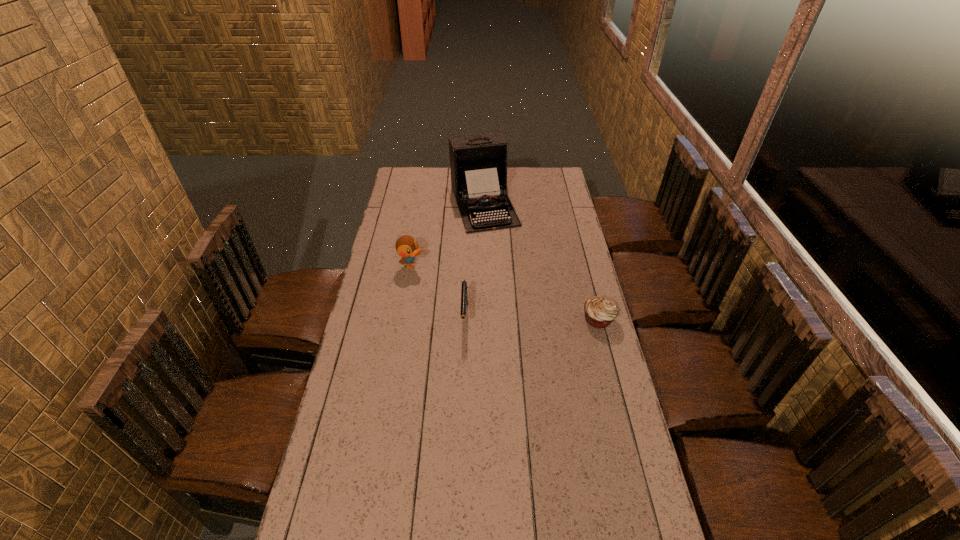
Locate an element on the screen. The width and height of the screenshot is (960, 540). vacant region at the left edge of the desktop is located at coordinates (392, 240).

Locate an element on the screen. This screenshot has height=540, width=960. free space at the right edge of the desktop is located at coordinates (606, 338).

This screenshot has height=540, width=960. Find the location of `vacant position at the far left corner of the desktop`. vacant position at the far left corner of the desktop is located at coordinates (398, 185).

This screenshot has width=960, height=540. I want to click on free location at the far right corner, so click(540, 187).

What are the coordinates of `vacant region between the third shortest object and the muffin` in the screenshot? It's located at (505, 292).

You are a GUI agent. You are given a task and a screenshot of the screen. Output one action in this format:
    pyautogui.click(x=<x>, y=<y>)
    Task: Click on the vacant space that is in between the duck and the rightmost object
    
    Given the screenshot: What is the action you would take?
    pyautogui.click(x=505, y=292)

At what (x,y) coordinates should I click in order to perform the action: click on free spot between the muffin and the pistol. Please return your answer as a coordinate pair (x, y). The width and height of the screenshot is (960, 540). Looking at the image, I should click on (532, 318).

Where is `vacant space that is in between the muffin and the pistol`? The image size is (960, 540). vacant space that is in between the muffin and the pistol is located at coordinates (532, 318).

At what (x,y) coordinates should I click in order to perform the action: click on empty location between the third shortest object and the muffin. Please return your answer as a coordinate pair (x, y). Looking at the image, I should click on (505, 292).

At what (x,y) coordinates should I click in order to perform the action: click on unoccupied area between the farthest object and the third nearest object. Please return your answer as a coordinate pair (x, y). Image resolution: width=960 pixels, height=540 pixels. Looking at the image, I should click on (447, 235).